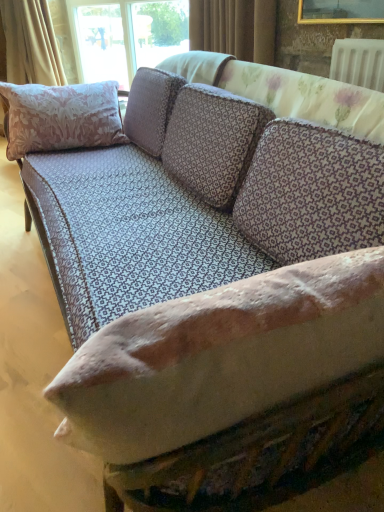
Question: Based on their sizes in the image, would you say beige fabric curtain at upper left, the second curtain in the front-to-back sequence, is bigger or smaller than pink floral fabric pillow at left?

Choices:
 (A) big
 (B) small

Answer: (A)

Question: Is beige fabric curtain at upper left, the second curtain in the front-to-back sequence, to the left or to the right of pink floral fabric pillow at left in the image?

Choices:
 (A) left
 (B) right

Answer: (A)

Question: Which of these objects is positioned farthest from the pink floral fabric pillow at left?

Choices:
 (A) beige fabric curtain at upper left, acting as the second curtain starting from the right
 (B) brown textured curtain at upper center, which is the first curtain from front to back

Answer: (A)

Question: Which is farther from the brown textured curtain at upper center, which is the first curtain from front to back?

Choices:
 (A) beige fabric curtain at upper left, the second curtain in the front-to-back sequence
 (B) pink floral fabric pillow at left

Answer: (A)